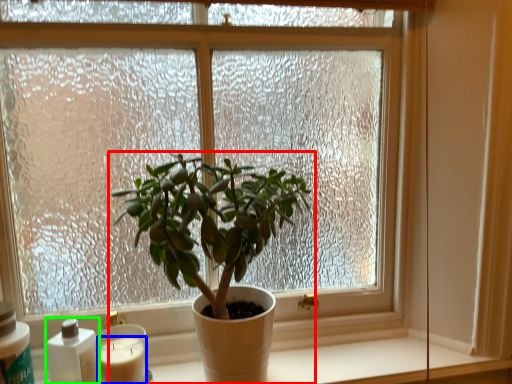
Question: Which object is the farthest from houseplant (highlighted by a red box)? Choose among these: candle (highlighted by a blue box) or bottle (highlighted by a green box).

Choices:
 (A) candle
 (B) bottle

Answer: (B)